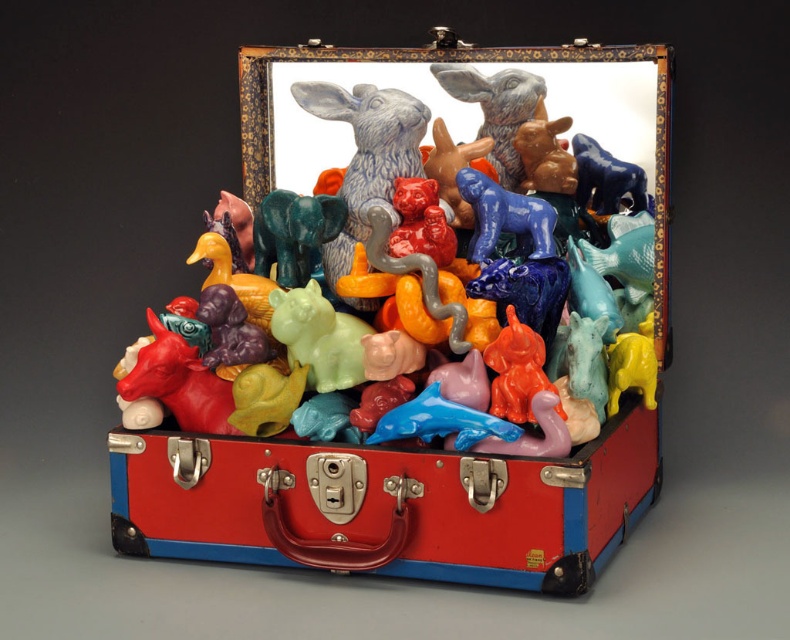
Question: Among these objects, which one is nearest to the camera?

Choices:
 (A) matte plastic animals at center
 (B) blue glossy dog at center
 (C) blue glossy horse at upper center

Answer: (A)

Question: Can you confirm if teal glossy elephant at center is positioned below blue glossy dog at center?

Choices:
 (A) no
 (B) yes

Answer: (B)

Question: Does teal glossy elephant at center have a lesser width compared to blue glossy horse at upper center?

Choices:
 (A) yes
 (B) no

Answer: (B)

Question: Estimate the real-world distances between objects in this image. Which object is closer to the blue glossy horse at upper center?

Choices:
 (A) matte ceramic rabbit at center
 (B) blue glossy dog at center
 (C) matte plastic animals at center

Answer: (B)

Question: Which object is farther from the camera taking this photo?

Choices:
 (A) blue glossy dog at center
 (B) teal glossy elephant at center
 (C) blue glossy horse at upper center
 (D) matte ceramic rabbit at center

Answer: (C)

Question: Does matte plastic animals at center lie in front of matte ceramic rabbit at center?

Choices:
 (A) no
 (B) yes

Answer: (B)